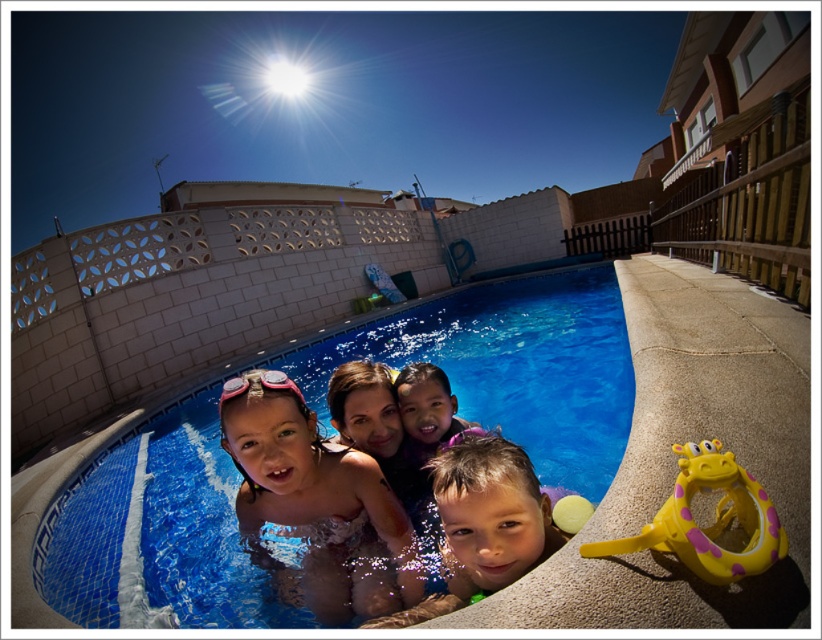
Question: Is pink rubber goggles at center below yellow rubber ring at lower right?

Choices:
 (A) yes
 (B) no

Answer: (A)

Question: Is pink rubber goggles at center behind pink rubber goggles at upper center?

Choices:
 (A) no
 (B) yes

Answer: (A)

Question: Which point is farther to the camera?

Choices:
 (A) pink rubber goggles at upper center
 (B) pink rubber goggles at center

Answer: (A)

Question: Does blue tile swimming pool at center have a smaller size compared to yellow rubber ring at lower right?

Choices:
 (A) yes
 (B) no

Answer: (B)

Question: Among these objects, which one is nearest to the camera?

Choices:
 (A) smooth skin child at center
 (B) yellow rubber ring at lower right

Answer: (B)

Question: Which point is closer to the camera taking this photo?

Choices:
 (A) [x=492, y=579]
 (B) [x=275, y=376]
 (C) [x=412, y=552]

Answer: (A)